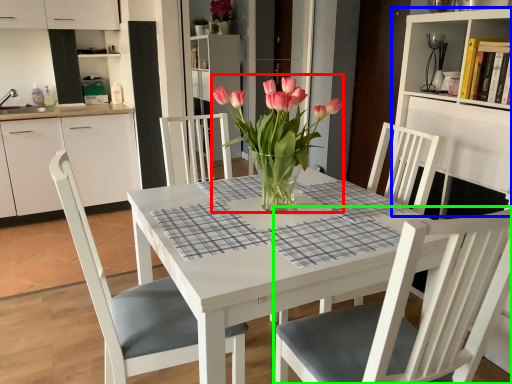
Question: Considering the real-world distances, which object is farthest from floral arrangement (highlighted by a red box)? bookshelf (highlighted by a blue box) or chair (highlighted by a green box)?

Choices:
 (A) bookshelf
 (B) chair

Answer: (A)